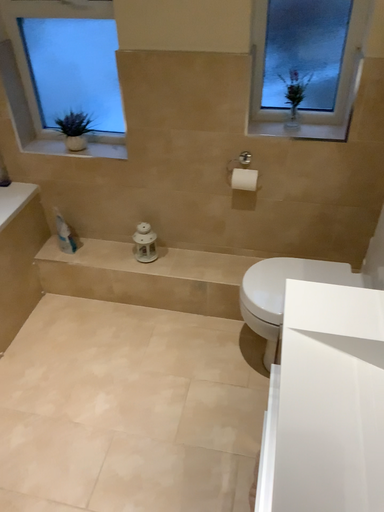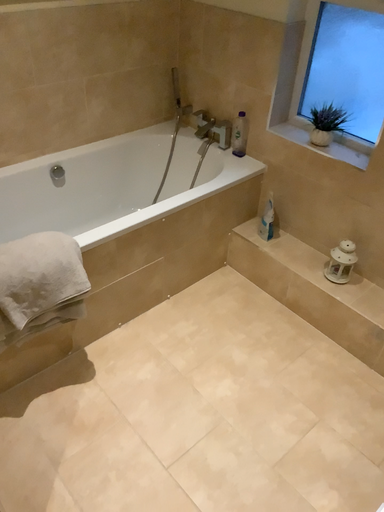
Question: How did the camera likely rotate when shooting the video?

Choices:
 (A) rotated right
 (B) rotated left

Answer: (B)